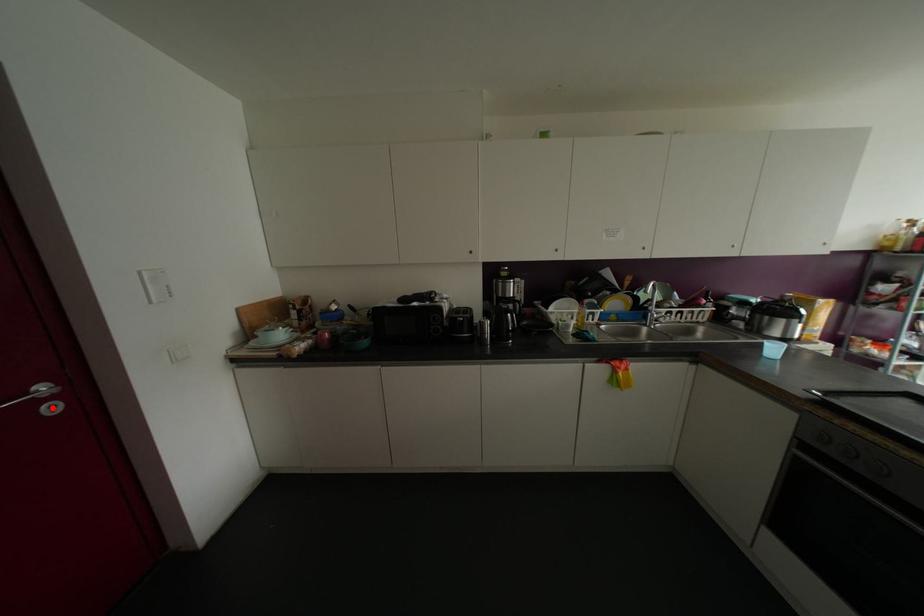
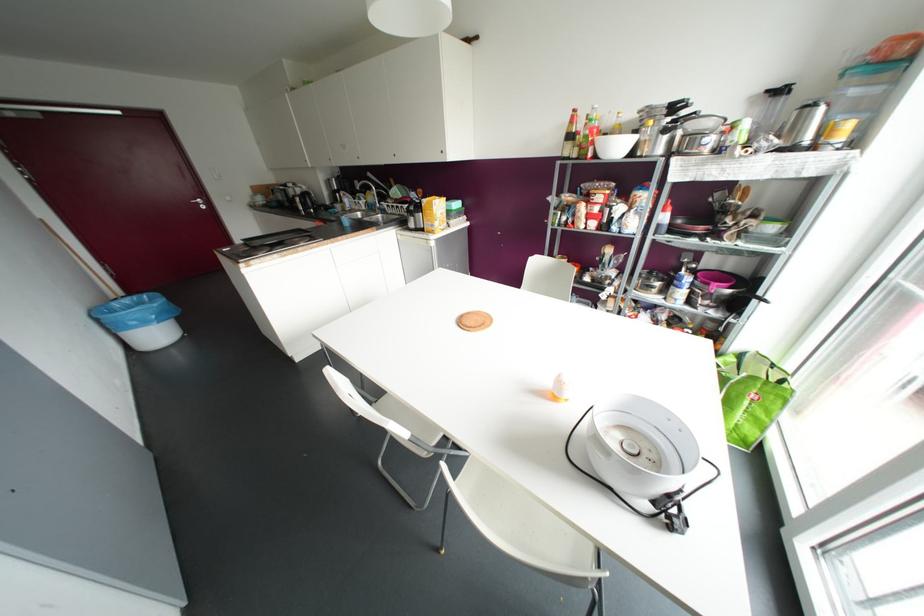
In the second image, find the point that corresponds to the highlighted location in the first image.

(202, 207)